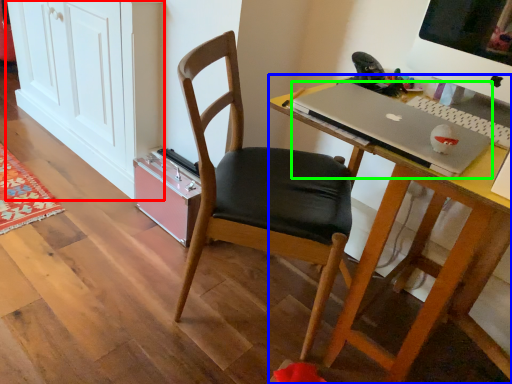
Question: Which object is the farthest from cabinetry (highlighted by a red box)? Choose among these: desk (highlighted by a blue box) or laptop (highlighted by a green box).

Choices:
 (A) desk
 (B) laptop

Answer: (A)